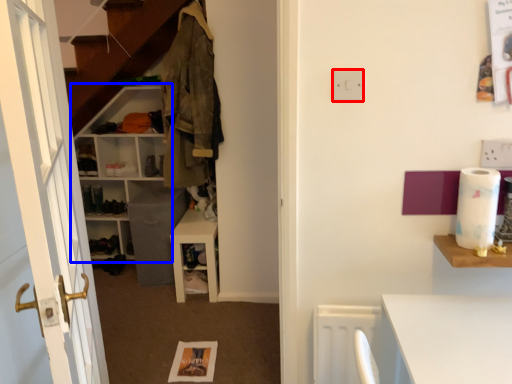
Question: Which object appears closest to the camera in this image, electric outlet (highlighted by a red box) or shelf (highlighted by a blue box)?

Choices:
 (A) electric outlet
 (B) shelf

Answer: (A)